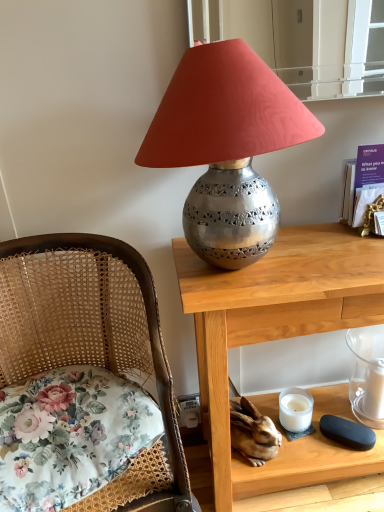
Question: Is white matte candle at lower right oriented away from transparent glass candle at lower right, which is counted as the 2th candle holder, starting from the left?

Choices:
 (A) no
 (B) yes

Answer: (B)

Question: From a real-world perspective, is white matte candle at lower right physically above transparent glass candle at lower right, acting as the first candle holder starting from the right?

Choices:
 (A) no
 (B) yes

Answer: (A)

Question: Considering the relative sizes of white matte candle at lower right and transparent glass candle at lower right, acting as the first candle holder starting from the right, in the image provided, is white matte candle at lower right bigger than transparent glass candle at lower right, acting as the first candle holder starting from the right,?

Choices:
 (A) no
 (B) yes

Answer: (A)

Question: Can you confirm if white matte candle at lower right is taller than transparent glass candle at lower right, acting as the first candle holder starting from the right?

Choices:
 (A) no
 (B) yes

Answer: (A)

Question: From a real-world perspective, is white matte candle at lower right below transparent glass candle at lower right, which is counted as the 2th candle holder, starting from the left?

Choices:
 (A) yes
 (B) no

Answer: (A)

Question: Does white matte candle at lower right come behind transparent glass candle at lower right, which is counted as the 2th candle holder, starting from the left?

Choices:
 (A) no
 (B) yes

Answer: (B)

Question: Is floral fabric cushion at left completely or partially outside of purple paper at upper right?

Choices:
 (A) yes
 (B) no

Answer: (A)

Question: From the image's perspective, does floral fabric cushion at left appear lower than purple paper at upper right?

Choices:
 (A) yes
 (B) no

Answer: (A)

Question: Considering the relative sizes of floral fabric cushion at left and purple paper at upper right in the image provided, is floral fabric cushion at left bigger than purple paper at upper right?

Choices:
 (A) no
 (B) yes

Answer: (B)

Question: Does floral fabric cushion at left lie in front of purple paper at upper right?

Choices:
 (A) yes
 (B) no

Answer: (A)

Question: Is floral fabric cushion at left positioned far away from purple paper at upper right?

Choices:
 (A) no
 (B) yes

Answer: (A)

Question: From a real-world perspective, does floral fabric cushion at left stand above purple paper at upper right?

Choices:
 (A) no
 (B) yes

Answer: (A)

Question: Can you see floral fabric cushion at left touching transparent glass candle at lower right, acting as the first candle holder starting from the right?

Choices:
 (A) no
 (B) yes

Answer: (A)